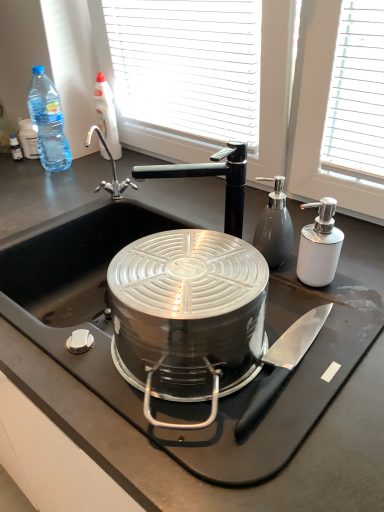
Question: Should I look upward or downward to see satin silver pump dispenser at right, which is the 1th bottle in front-to-back order?

Choices:
 (A) down
 (B) up

Answer: (B)

Question: Considering the relative sizes of satin silver pump dispenser at right, which is the 3th bottle from left to right, and clear plastic bottle at upper left, which is the 3th bottle from front to back, in the image provided, is satin silver pump dispenser at right, which is the 3th bottle from left to right, taller than clear plastic bottle at upper left, which is the 3th bottle from front to back,?

Choices:
 (A) yes
 (B) no

Answer: (B)

Question: Can you confirm if satin silver pump dispenser at right, which is the 3th bottle from left to right, is bigger than clear plastic bottle at upper left, which ranks as the second bottle in right-to-left order?

Choices:
 (A) yes
 (B) no

Answer: (B)

Question: Considering the relative sizes of satin silver pump dispenser at right, positioned as the 1th bottle in right-to-left order, and clear plastic bottle at upper left, which appears as the 2th bottle when viewed from the left, in the image provided, is satin silver pump dispenser at right, positioned as the 1th bottle in right-to-left order, smaller than clear plastic bottle at upper left, which appears as the 2th bottle when viewed from the left,?

Choices:
 (A) no
 (B) yes

Answer: (B)

Question: Can you see satin silver pump dispenser at right, which is the 3th bottle from left to right, touching clear plastic bottle at upper left, which is the 3th bottle from front to back?

Choices:
 (A) yes
 (B) no

Answer: (B)

Question: Would you say satin silver pump dispenser at right, which is the 1th bottle in front-to-back order, is outside clear plastic bottle at upper left, which ranks as the second bottle in right-to-left order?

Choices:
 (A) yes
 (B) no

Answer: (A)

Question: Would you say satin silver pump dispenser at right, which is the 1th bottle in front-to-back order, is a long distance from clear plastic bottle at upper left, which ranks as the second bottle in right-to-left order?

Choices:
 (A) no
 (B) yes

Answer: (A)

Question: From a real-world perspective, is black matte faucet at upper center on top of blue plastic bottle at upper left, the first bottle in the left-to-right sequence?

Choices:
 (A) no
 (B) yes

Answer: (A)

Question: Considering the relative sizes of black matte faucet at upper center and blue plastic bottle at upper left, which appears as the 2th bottle when viewed from the front, in the image provided, is black matte faucet at upper center taller than blue plastic bottle at upper left, which appears as the 2th bottle when viewed from the front,?

Choices:
 (A) no
 (B) yes

Answer: (A)

Question: From a real-world perspective, is black matte faucet at upper center under blue plastic bottle at upper left, the second bottle when ordered from back to front?

Choices:
 (A) no
 (B) yes

Answer: (B)

Question: Is black matte faucet at upper center at the right side of blue plastic bottle at upper left, which appears as the 2th bottle when viewed from the front?

Choices:
 (A) no
 (B) yes

Answer: (B)

Question: Is black matte faucet at upper center bigger than blue plastic bottle at upper left, the first bottle in the left-to-right sequence?

Choices:
 (A) yes
 (B) no

Answer: (A)

Question: Can you confirm if black matte faucet at upper center is positioned to the left of blue plastic bottle at upper left, acting as the third bottle starting from the right?

Choices:
 (A) yes
 (B) no

Answer: (B)

Question: Is black matte faucet at upper center facing towards black matte countertop at center?

Choices:
 (A) yes
 (B) no

Answer: (B)